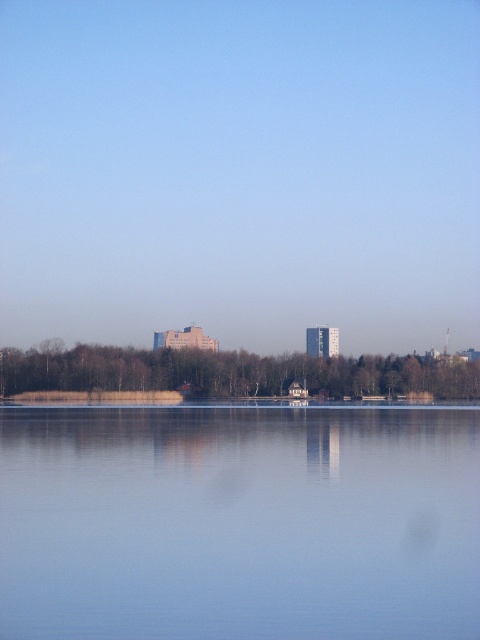
You are a photographer planning to capture the smooth concrete buildings at center and the transparent glass water at center in a single shot. Based on their heights, which one will appear larger in the photo?

The smooth concrete buildings at center is taller than transparent glass water at center, so it will appear larger in the photo.

You are standing at the center of the lakeside and want to take a photo that includes both the smooth concrete buildings at center and the small red roofed house. Based on their positions, which building should be placed on the left side of the photo to ensure both are visible?

The smooth concrete buildings at center are located at point (240, 172), so to include both in the photo, the small red roofed house should be positioned to the right of the smooth concrete buildings at center. Therefore, the smooth concrete buildings at center should be on the left side of the photo.